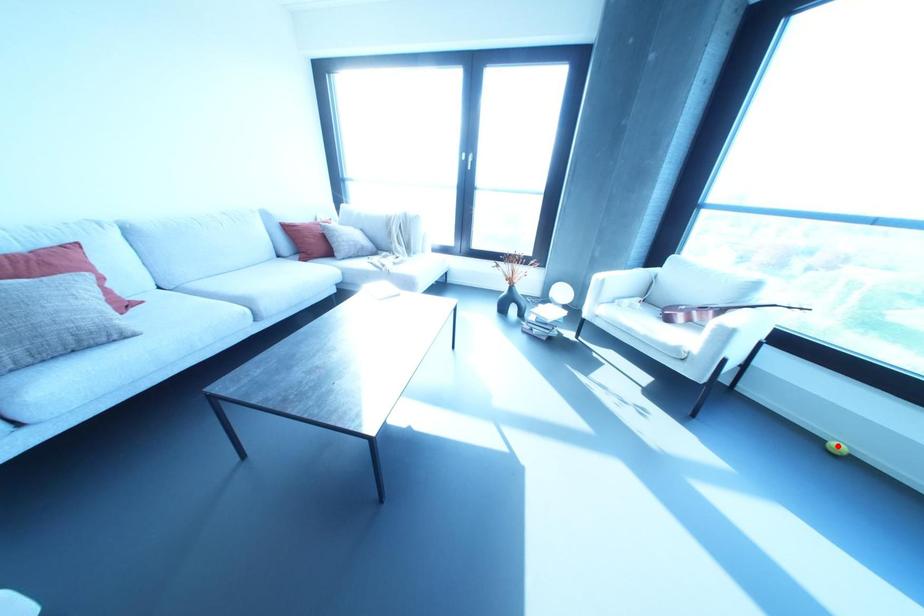
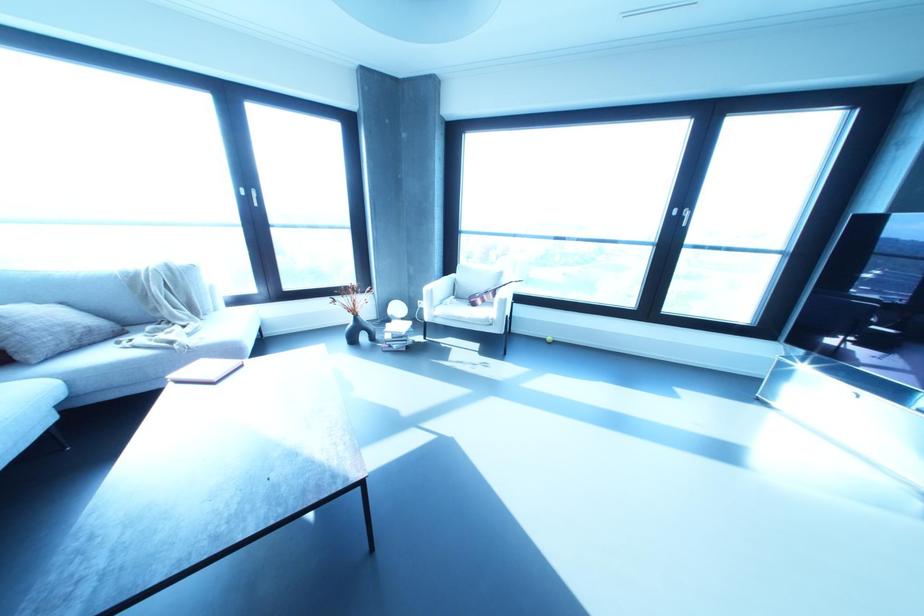
In the second image, find the point that corresponds to the highlighted location in the first image.

(548, 338)